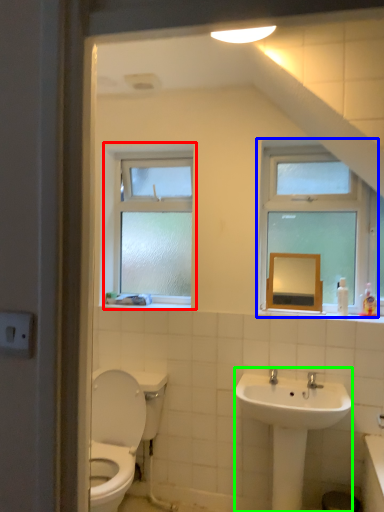
Question: Which object is positioned farthest from window (highlighted by a red box)? Select from window (highlighted by a blue box) and sink (highlighted by a green box).

Choices:
 (A) window
 (B) sink

Answer: (B)